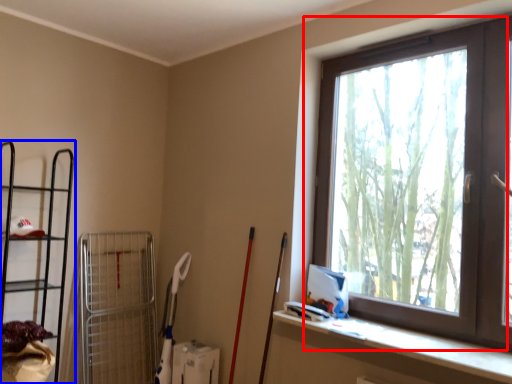
Question: Which of the following is the closest to the observer, window (highlighted by a red box) or shelf (highlighted by a blue box)?

Choices:
 (A) window
 (B) shelf

Answer: (A)